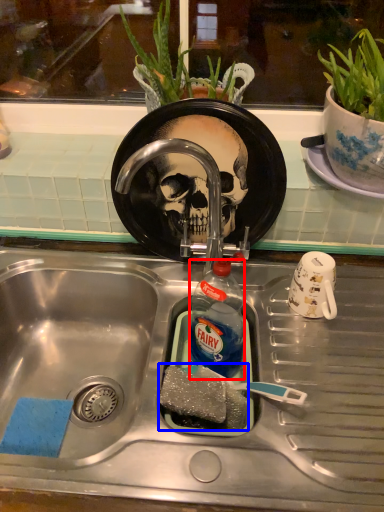
Question: Which object is further to the camera taking this photo, bottle (highlighted by a red box) or food (highlighted by a blue box)?

Choices:
 (A) bottle
 (B) food

Answer: (A)